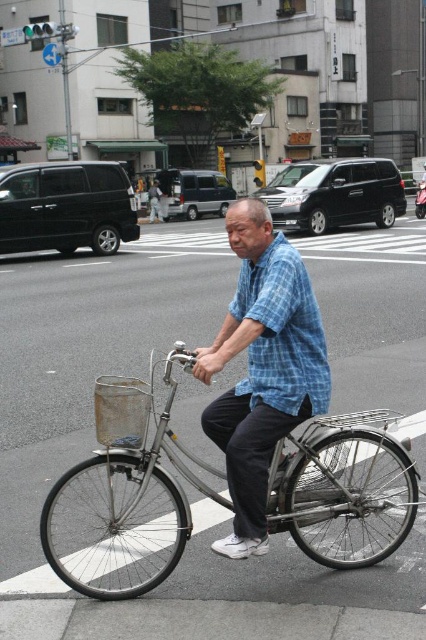
Is point (124, 378) positioned in front of point (256, 336)?

That is False.

Can you confirm if silver metallic bicycle at center is bigger than blue plaid shirt at center?

Yes, silver metallic bicycle at center is bigger than blue plaid shirt at center.

The width and height of the screenshot is (426, 640). Describe the element at coordinates (124, 497) in the screenshot. I see `silver metallic bicycle at center` at that location.

You are a GUI agent. You are given a task and a screenshot of the screen. Output one action in this format:
    pyautogui.click(x=<x>, y=<y>)
    Task: Click on the silver metallic bicycle at center
    The height and width of the screenshot is (640, 426).
    Given the screenshot: What is the action you would take?
    pyautogui.click(x=124, y=497)